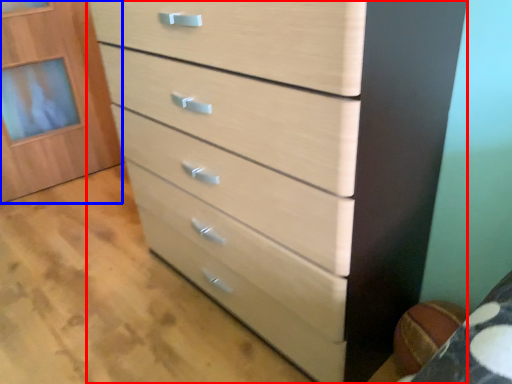
Question: Which point is closer to the camera, chest of drawers (highlighted by a red box) or cabinetry (highlighted by a blue box)?

Choices:
 (A) chest of drawers
 (B) cabinetry

Answer: (A)